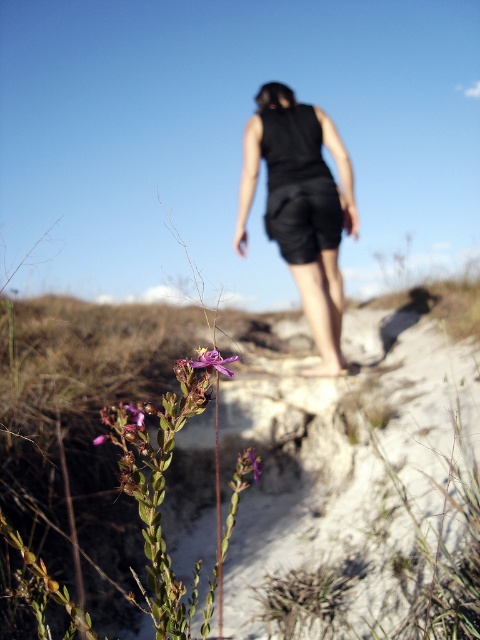
You are a photographer trying to capture the purple matte flower at center while ensuring the black matte shorts at center doesn t block the view. Given their sizes, is it possible to adjust your camera angle to fully frame the flower without the shorts obstructing it?

The black matte shorts at center is bigger than the purple matte flower at center. Since the shorts are larger, adjusting the camera angle might be challenging, but by moving closer to the flower or tilting the camera slightly downward, you could potentially frame the flower so that the smaller flower isn t obscured by the larger shorts.

You are standing in the serene outdoor scene under a clear blue sky. You see the black matte shorts at center. Can you determine their exact location coordinates?

The black matte shorts at center are located at coordinates point (301, 208).